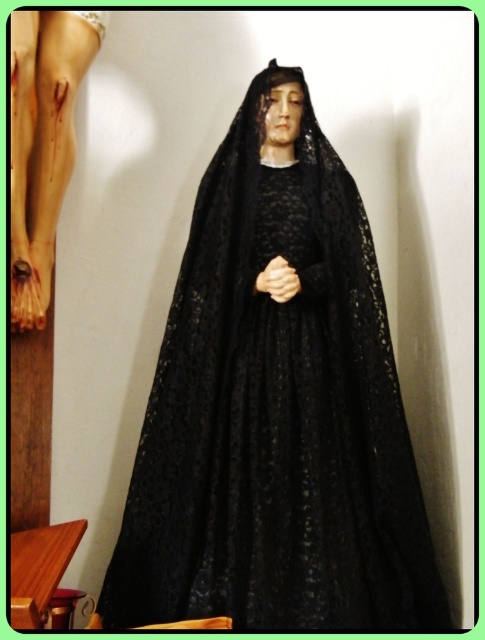
Question: Which object appears farthest from the camera in this image?

Choices:
 (A) black lace statue at center
 (B) matte black statue at upper center

Answer: (A)

Question: Does black lace statue at center have a smaller size compared to matte black statue at upper center?

Choices:
 (A) yes
 (B) no

Answer: (B)

Question: Can you confirm if black lace statue at center is positioned above matte black statue at upper center?

Choices:
 (A) no
 (B) yes

Answer: (A)

Question: Does black lace statue at center have a larger size compared to matte black statue at upper center?

Choices:
 (A) no
 (B) yes

Answer: (B)